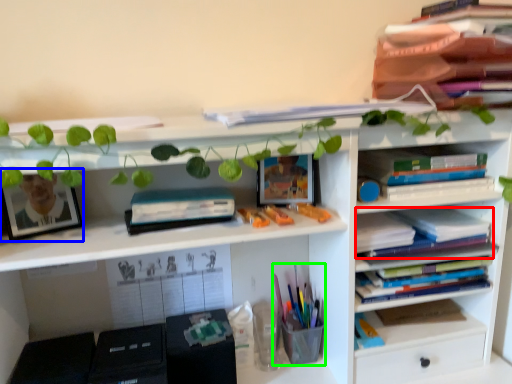
Question: Based on their relative distances, which object is farther from book (highlighted by a red box)? Choose from picture frame (highlighted by a blue box) and stationery (highlighted by a green box).

Choices:
 (A) picture frame
 (B) stationery

Answer: (A)